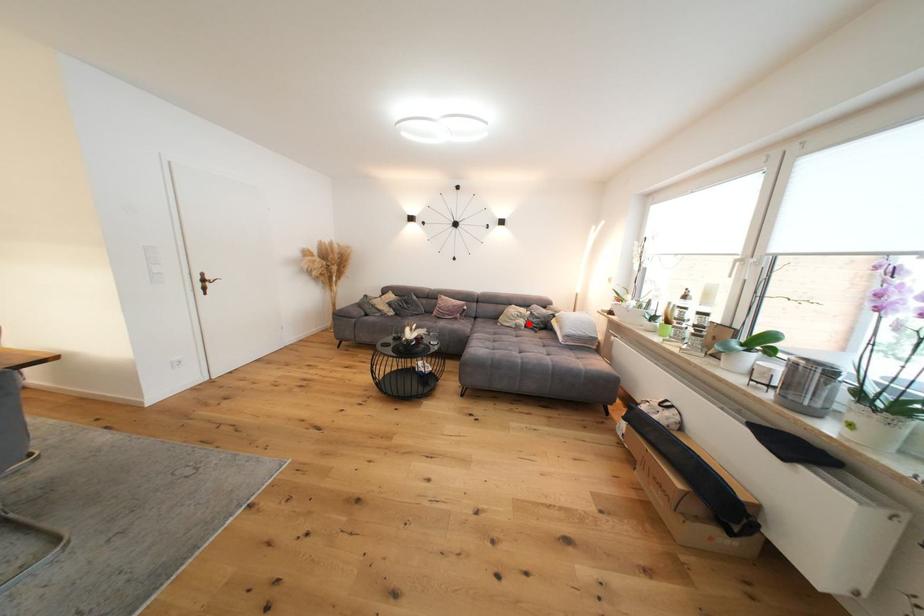
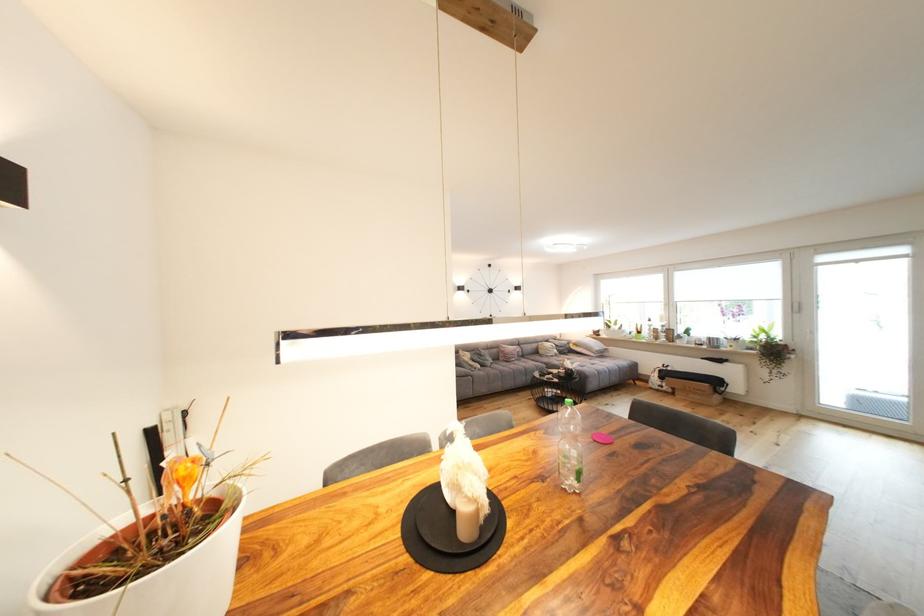
In the second image, find the point that corresponds to the highlighted location in the first image.

(563, 353)